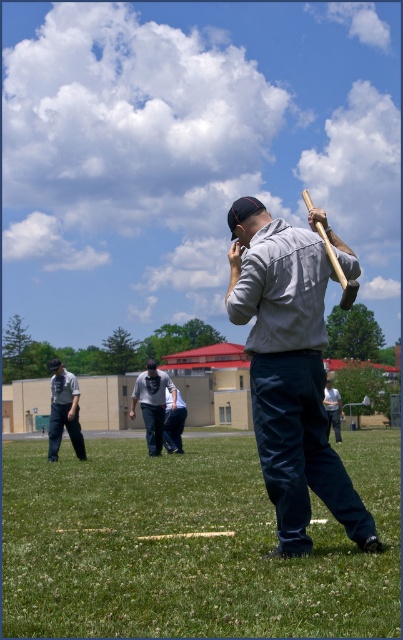
Does dark gray shirt at center appear under light gray shirt at center?

Incorrect, dark gray shirt at center is not positioned below light gray shirt at center.

Can you confirm if dark gray shirt at center is bigger than light gray shirt at center?

Incorrect, dark gray shirt at center is not larger than light gray shirt at center.

Who is more forward, (x=170, y=387) or (x=322, y=400)?

Point (x=322, y=400) is more forward.

Where is `dark gray shirt at center`? Image resolution: width=403 pixels, height=640 pixels. dark gray shirt at center is located at coordinates (153, 403).

Is point (284, 257) farther from camera compared to point (176, 412)?

No, (284, 257) is closer to viewer.

Is point (238, 230) less distant than point (168, 436)?

Yes, point (238, 230) is in front of point (168, 436).

Locate an element on the screen. This screenshot has width=403, height=640. matte gray shirt at center is located at coordinates (290, 372).

Image resolution: width=403 pixels, height=640 pixels. Identify the location of matte gray shirt at center. (290, 372).

This screenshot has width=403, height=640. Describe the element at coordinates (290, 372) in the screenshot. I see `matte gray shirt at center` at that location.

Which is in front, point (253, 230) or point (76, 396)?

Point (253, 230)

Where is `matte gray shirt at center`? Image resolution: width=403 pixels, height=640 pixels. matte gray shirt at center is located at coordinates (290, 372).